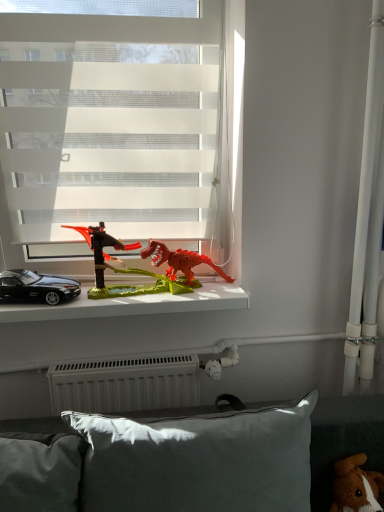
Question: Could you tell me if black plastic car at left is turned towards brown plush toy at lower right, the 1th toy viewed from the right?

Choices:
 (A) no
 (B) yes

Answer: (A)

Question: Is black plastic car at left completely or partially outside of brown plush toy at lower right, the 1th toy viewed from the right?

Choices:
 (A) yes
 (B) no

Answer: (A)

Question: Can you confirm if black plastic car at left is positioned to the left of brown plush toy at lower right, which is counted as the second toy, starting from the top?

Choices:
 (A) no
 (B) yes

Answer: (B)

Question: Can you confirm if black plastic car at left is taller than brown plush toy at lower right, the 2th toy from the back?

Choices:
 (A) no
 (B) yes

Answer: (A)

Question: Is black plastic car at left behind brown plush toy at lower right, placed as the 2th toy when sorted from left to right?

Choices:
 (A) yes
 (B) no

Answer: (A)

Question: Considering the positions of brown plush toy at lower right, acting as the first toy starting from the front, and white translucent blinds at upper center in the image, is brown plush toy at lower right, acting as the first toy starting from the front, taller or shorter than white translucent blinds at upper center?

Choices:
 (A) short
 (B) tall

Answer: (A)

Question: Is brown plush toy at lower right, the 2th toy from the back, inside the boundaries of white translucent blinds at upper center, or outside?

Choices:
 (A) inside
 (B) outside

Answer: (B)

Question: Is brown plush toy at lower right, placed as the 2th toy when sorted from left to right, to the left or to the right of white translucent blinds at upper center in the image?

Choices:
 (A) left
 (B) right

Answer: (B)

Question: Considering the positions of point (339, 479) and point (13, 101), is point (339, 479) closer or farther from the camera than point (13, 101)?

Choices:
 (A) farther
 (B) closer

Answer: (B)

Question: Considering the positions of point (115, 434) and point (8, 313), is point (115, 434) closer or farther from the camera than point (8, 313)?

Choices:
 (A) closer
 (B) farther

Answer: (A)

Question: Relative to black plastic car at left, is gray fabric pillow at lower center in front or behind?

Choices:
 (A) front
 (B) behind

Answer: (A)

Question: From the image's perspective, is gray fabric pillow at lower center positioned above or below black plastic car at left?

Choices:
 (A) below
 (B) above

Answer: (A)

Question: Would you say gray fabric pillow at lower center is inside or outside black plastic car at left?

Choices:
 (A) outside
 (B) inside

Answer: (A)

Question: Is rubberized red dinosaur at center, positioned as the second toy in right-to-left order, taller or shorter than gray fabric pillow at lower center?

Choices:
 (A) short
 (B) tall

Answer: (A)

Question: From the image's perspective, is rubberized red dinosaur at center, placed as the first toy when sorted from back to front, above or below gray fabric pillow at lower center?

Choices:
 (A) above
 (B) below

Answer: (A)